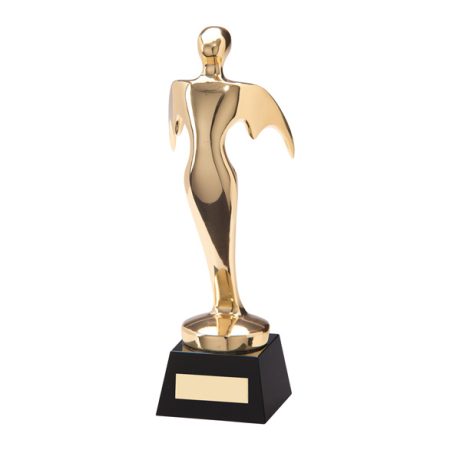
Identify the location of stand. (280, 393).